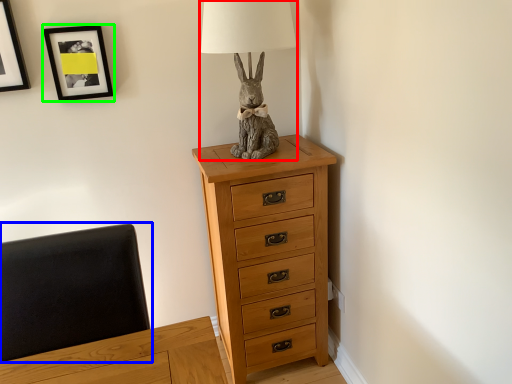
Question: Based on their relative distances, which object is farther from table lamp (highlighted by a red box)? Choose from swivel chair (highlighted by a blue box) and picture frame (highlighted by a green box).

Choices:
 (A) swivel chair
 (B) picture frame

Answer: (A)